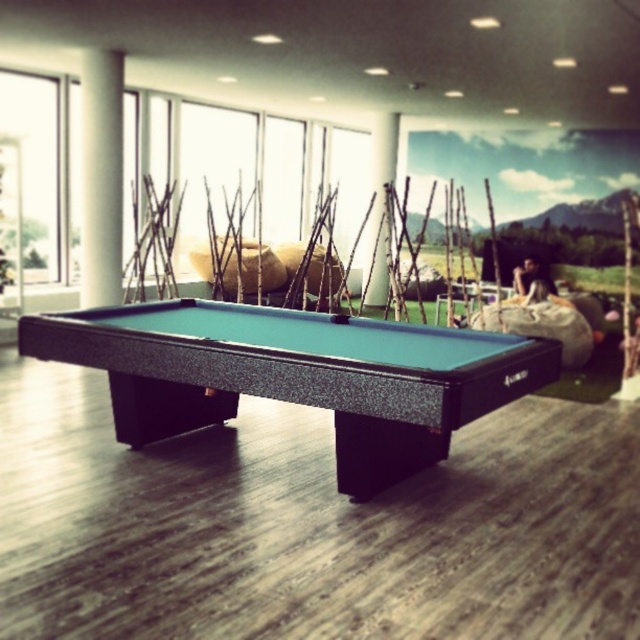
Between green felt pool table at center and white matte pillar at center, which one appears on the right side from the viewer's perspective?

white matte pillar at center is more to the right.

Is point (428, 461) in front of point (378, 234)?

Yes.

Is point (294, 316) in front of point (385, 234)?

Yes, it is in front of point (385, 234).

The width and height of the screenshot is (640, 640). Identify the location of green felt pool table at center. (296, 374).

How distant is transparent glass window at upper left from white matte pillar at center?

They are 5.88 meters apart.

Can you confirm if transparent glass window at upper left is positioned above white matte pillar at center?

No, transparent glass window at upper left is not above white matte pillar at center.

Which is in front, point (36, 164) or point (371, 264)?

Positioned in front is point (36, 164).

You are a GUI agent. You are given a task and a screenshot of the screen. Output one action in this format:
    pyautogui.click(x=<x>, y=<y>)
    Task: Click on the transparent glass window at upper left
    The width and height of the screenshot is (640, 640).
    Given the screenshot: What is the action you would take?
    pyautogui.click(x=35, y=168)

Which is in front, point (227, 403) or point (93, 208)?

Point (227, 403)

Measure the distance between green felt pool table at center and camera.

The distance of green felt pool table at center from camera is 2.76 meters.

Is point (332, 408) closer to camera compared to point (113, 157)?

Yes, it is.

Image resolution: width=640 pixels, height=640 pixels. Find the location of `green felt pool table at center`. green felt pool table at center is located at coordinates tap(296, 374).